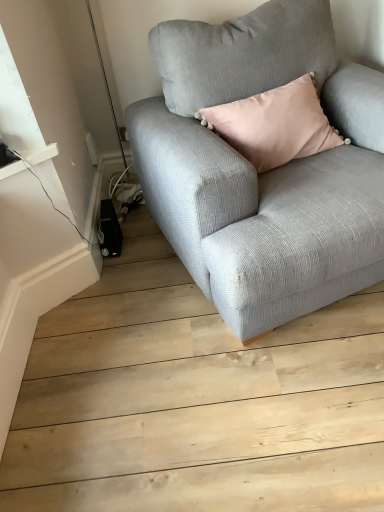
At what (x,y) coordinates should I click in order to perform the action: click on vacant area situated to the left side of textured gray couch at center. Please return your answer as a coordinate pair (x, y). Looking at the image, I should click on (113, 340).